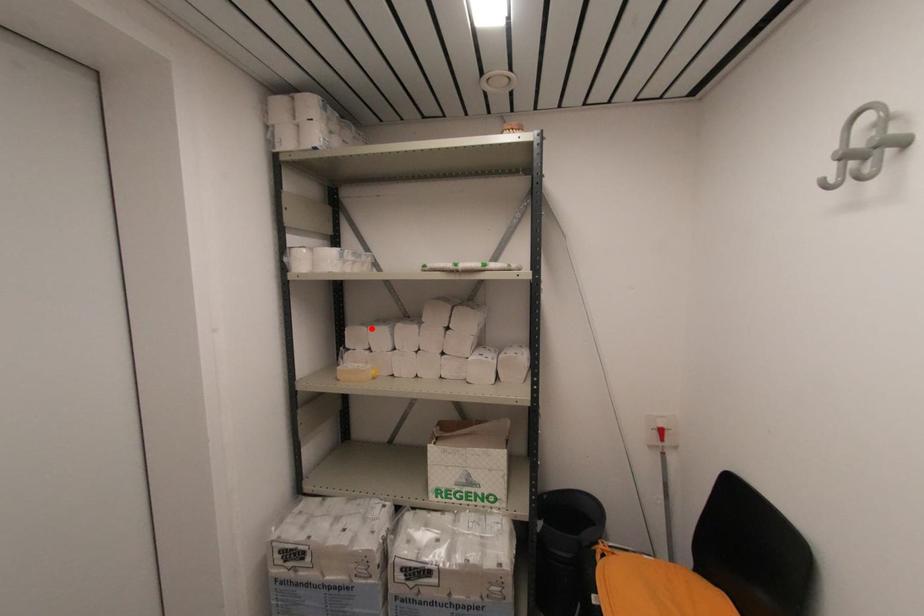
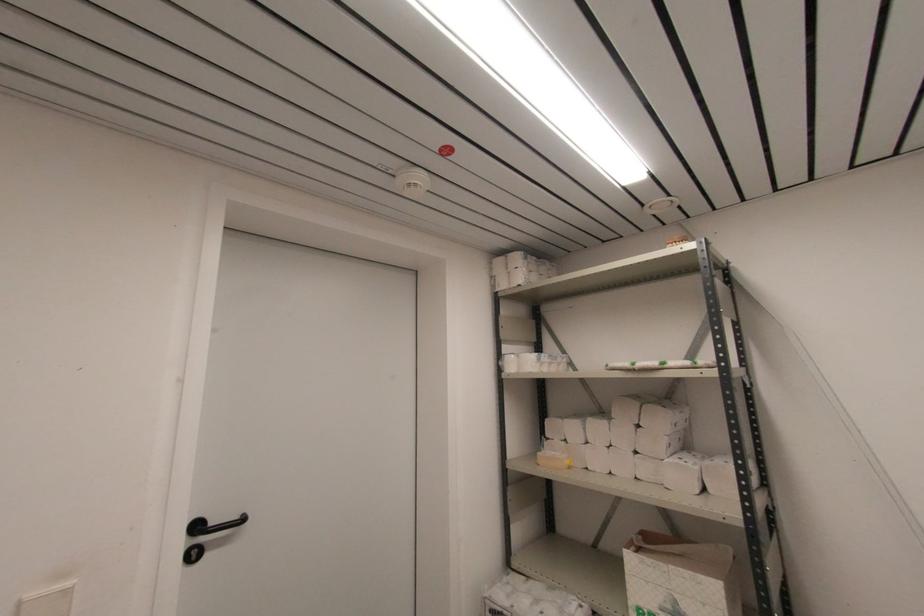
Where in the second image is the point corresponding to the highlighted location from the first image?

(566, 421)